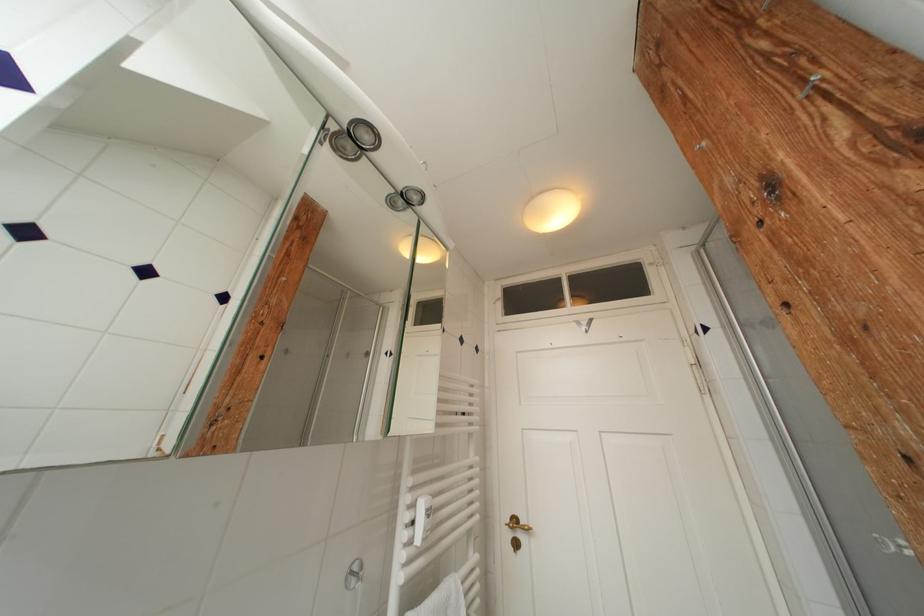
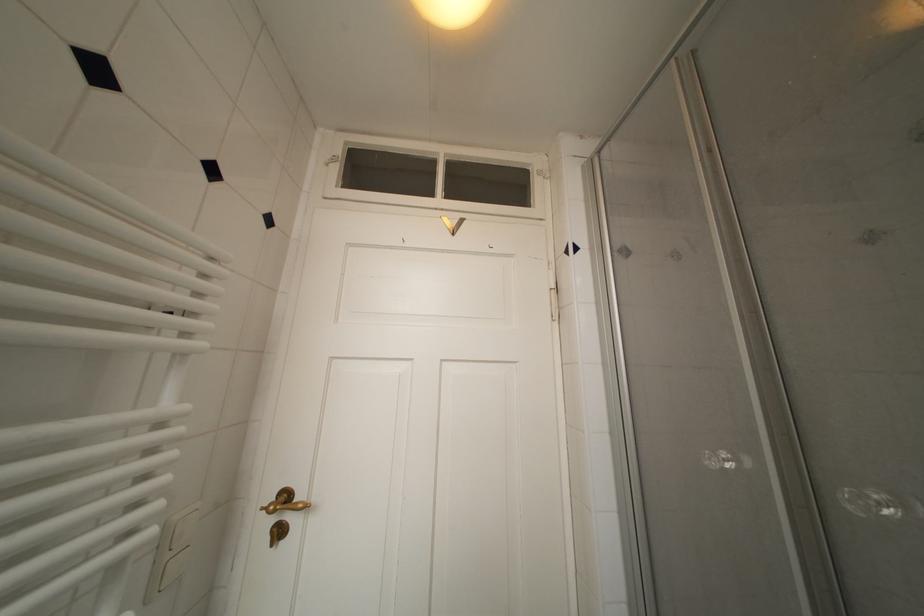
Find the pixel in the second image that matches pixel 521 525 in the first image.

(293, 500)